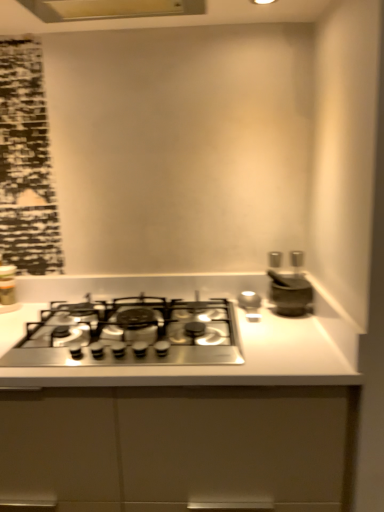
Question: Is stainless steel gas stove at center taller or shorter than metallic silver canister at left?

Choices:
 (A) short
 (B) tall

Answer: (A)

Question: Looking at the image, does stainless steel gas stove at center seem bigger or smaller compared to metallic silver canister at left?

Choices:
 (A) small
 (B) big

Answer: (B)

Question: Which is nearer to the satin silver mortar at right?

Choices:
 (A) stainless steel gas stove at center
 (B) metallic silver canister at left
 (C) matte white exhaust hood at upper center

Answer: (A)

Question: Which is nearer to the metallic silver canister at left?

Choices:
 (A) stainless steel gas stove at center
 (B) satin silver mortar at right
 (C) matte white exhaust hood at upper center

Answer: (A)